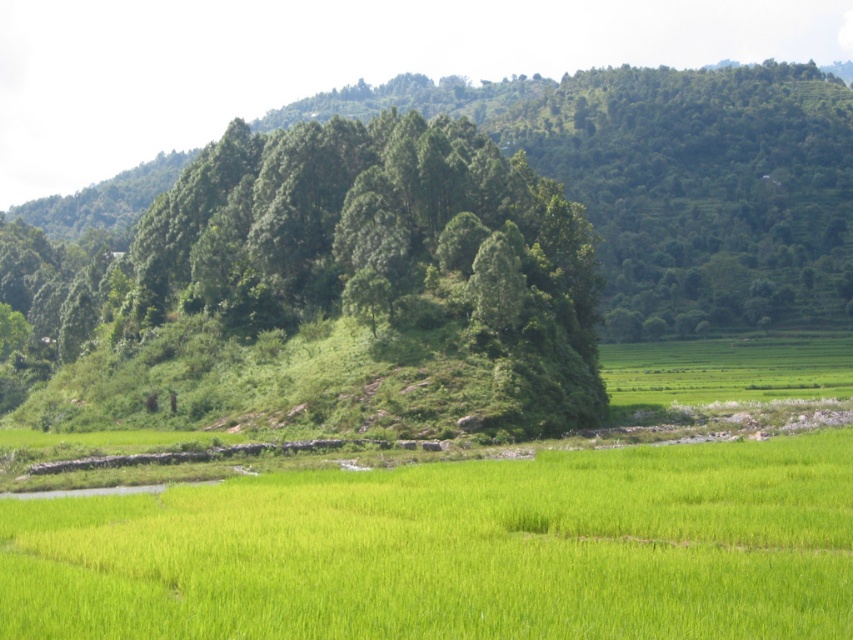
You are a farmer standing in the middle of the green grassy field at center. You want to climb the green leafy tree at center to check the health of its leaves. Is the tree within your reach from your current position?

The green leafy tree at center is taller than the green grassy field at center, so it is likely out of your reach while standing on the field. You would need a ladder or some climbing aid to reach the tree.

You are standing at the center of the field and want to plant a new tree exactly where the green leafy tree at center is currently located. Given that the coordinates of the field are mapped from 0 to 1 in both x and y axes, can you confirm if the chosen spot is within the central 0.2x0.2 square area of the field?

The green leafy tree at center is located at point (460, 252). The central 0.2x0.2 square area would range from 0.4 to 0.6 on both axes. Since 0.395 is just below 0.4 on the x and 0.540 is within the y range, the tree is slightly outside the central area on the x axis. Therefore, the spot is not within the central square.